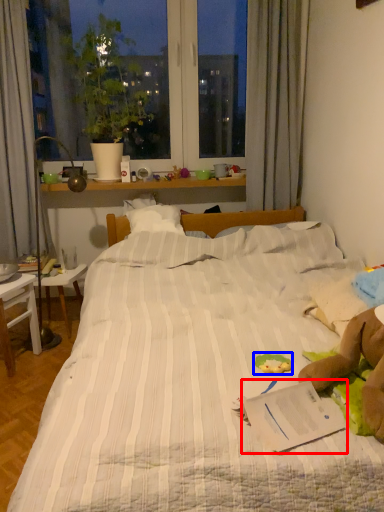
Question: Which of the following is the farthest to the observer, paperback book (highlighted by a red box) or stuff (highlighted by a blue box)?

Choices:
 (A) paperback book
 (B) stuff

Answer: (B)